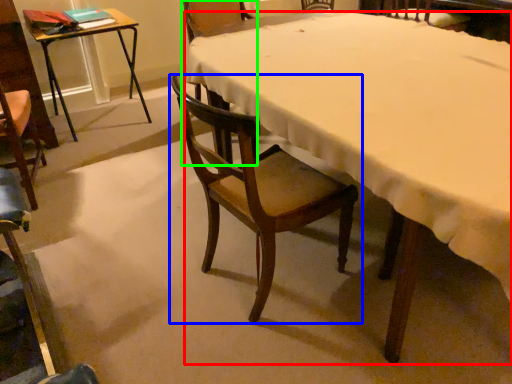
Question: Which object is positioned farthest from desk (highlighted by a red box)? Select from chair (highlighted by a blue box) and chair (highlighted by a green box).

Choices:
 (A) chair
 (B) chair

Answer: (B)